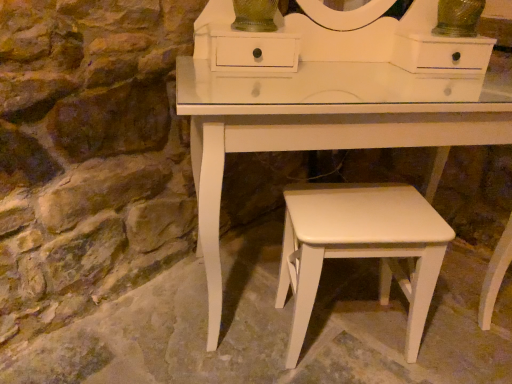
At what (x,y) coordinates should I click in order to perform the action: click on blank space situated above white matte stool at center (from a real-world perspective). Please return your answer as a coordinate pair (x, y). The image size is (512, 384). Looking at the image, I should click on (361, 211).